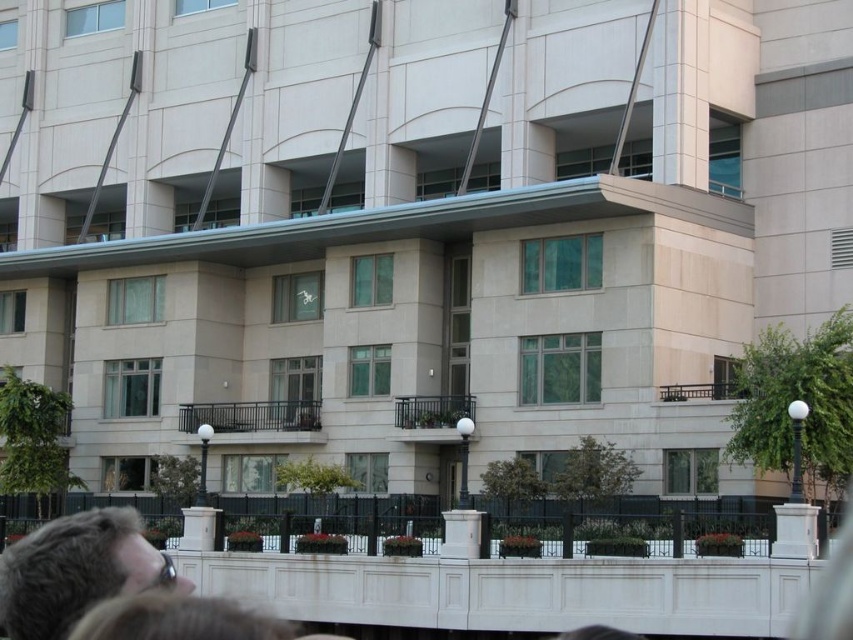
Question: Among these points, which one is farthest from the camera?

Choices:
 (A) (566, 636)
 (B) (154, 572)
 (C) (102, 604)

Answer: (A)

Question: Can you confirm if dark brown hair at lower left is positioned to the left of blonde hair at lower left?

Choices:
 (A) no
 (B) yes

Answer: (B)

Question: Is blonde hair at lower left above brown hair at lower center?

Choices:
 (A) yes
 (B) no

Answer: (A)

Question: Which point appears farthest from the camera in this image?

Choices:
 (A) pyautogui.click(x=595, y=637)
 (B) pyautogui.click(x=178, y=605)
 (C) pyautogui.click(x=56, y=612)

Answer: (A)

Question: Is blonde hair at lower left smaller than brown hair at lower center?

Choices:
 (A) yes
 (B) no

Answer: (B)

Question: Which point is farther from the camera taking this photo?

Choices:
 (A) (236, 624)
 (B) (70, 564)
 (C) (605, 627)

Answer: (C)